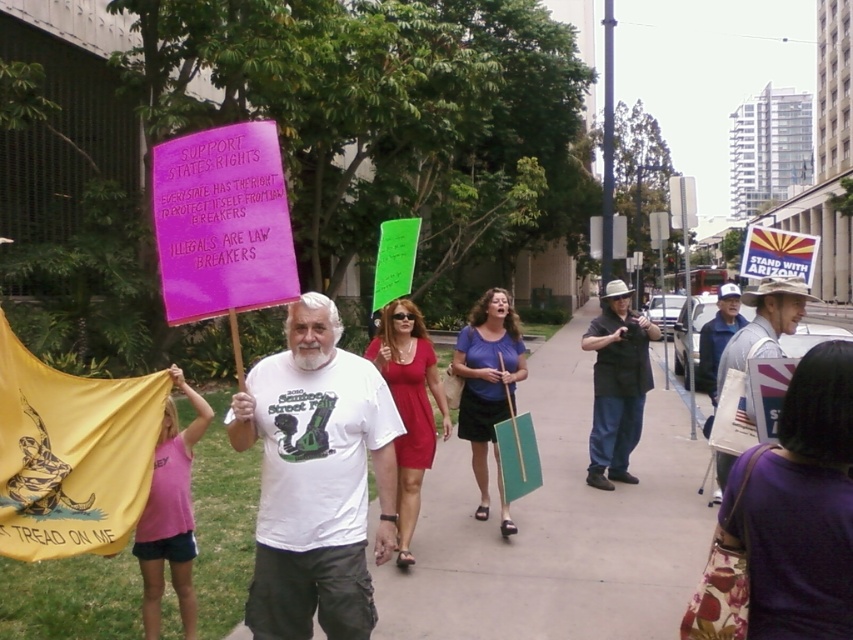
Does yellow fabric flag at lower left lie in front of black matte shirt at center?

Yes, it is.

Does point (10, 348) lie behind point (619, 316)?

That is False.

Find the location of `yellow fabric flag at lower left`. yellow fabric flag at lower left is located at coordinates (71, 454).

Between concrete sidewalk at center and white cowboy hat at center, which one is positioned higher?

white cowboy hat at center

Which of these two, concrete sidewalk at center or white cowboy hat at center, stands shorter?

white cowboy hat at center

Which is behind, point (547, 467) or point (782, 298)?

The point (547, 467) is behind.

I want to click on concrete sidewalk at center, so click(560, 524).

The image size is (853, 640). What do you see at coordinates (560, 524) in the screenshot? I see `concrete sidewalk at center` at bounding box center [560, 524].

Locate an element on the screen. concrete sidewalk at center is located at coordinates (560, 524).